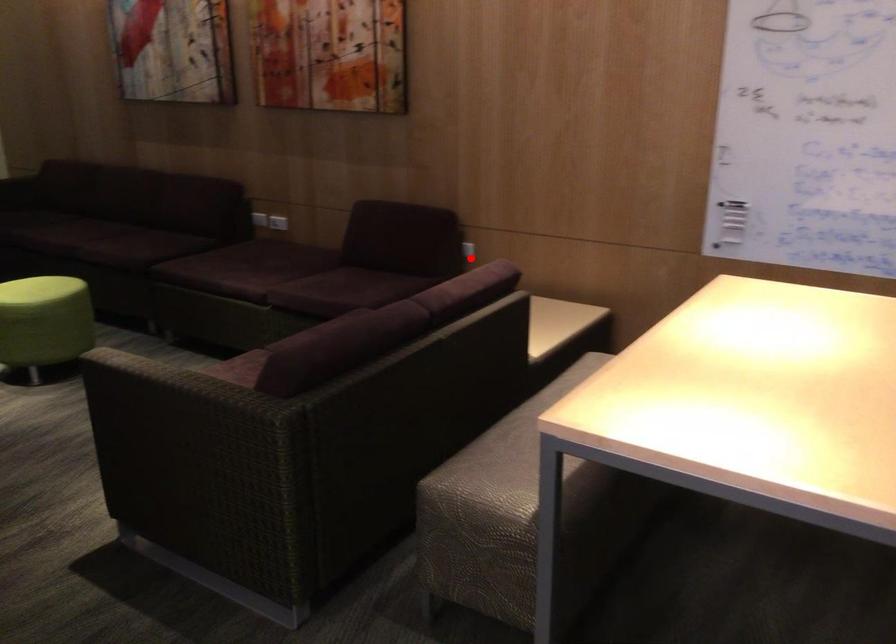
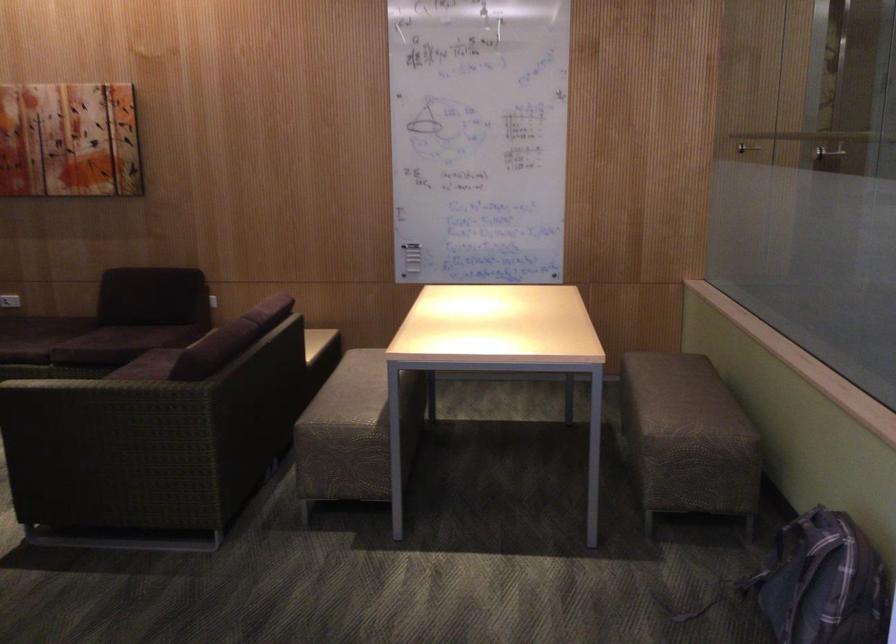
In the second image, find the point that corresponds to the highlighted location in the first image.

(210, 301)